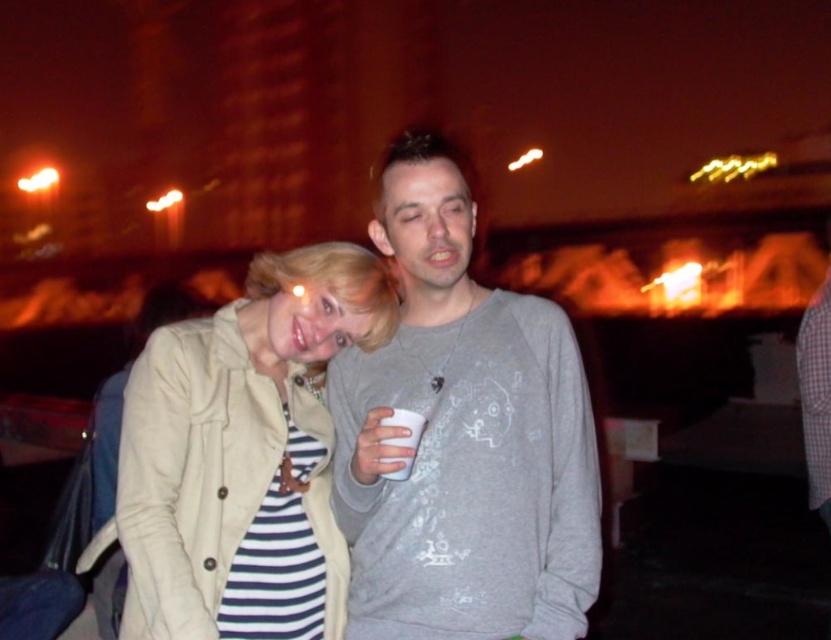
You are trying to decide which piece of clothing is nearer to you in the image. You see the gray cotton sweatshirt at center and the beige fabric jacket at center. Which one is closer to you?

The gray cotton sweatshirt at center is closer to the viewer than the beige fabric jacket at center.

You are organizing a charity event and need to ensure that all items are within a 30 cm safety distance from each other for easy access. You have a gray cotton sweatshirt at center and a white paper cup at center. Are these two items within the required safety distance?

The gray cotton sweatshirt at center and white paper cup at center are 31.01 centimeters apart from each other, which exceeds the 30 cm safety distance requirement. Therefore, they are not within the required safety distance.